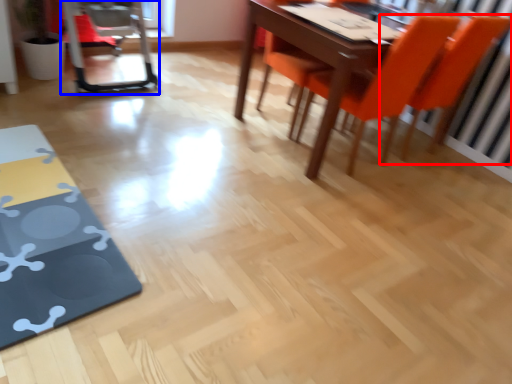
Question: Among these objects, which one is farthest to the camera, chair (highlighted by a red box) or swivel chair (highlighted by a blue box)?

Choices:
 (A) chair
 (B) swivel chair

Answer: (B)